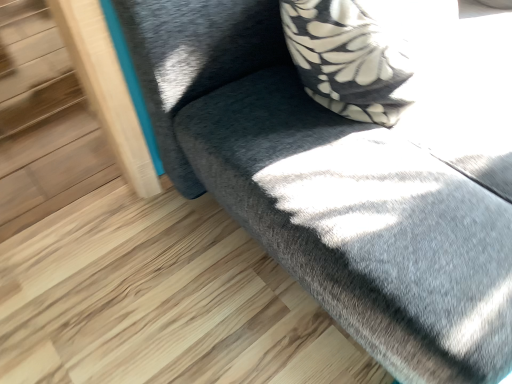
Identify the location of vacant space situated above transparent glass door at left (from a real-world perspective). Image resolution: width=512 pixels, height=384 pixels. (37, 89).